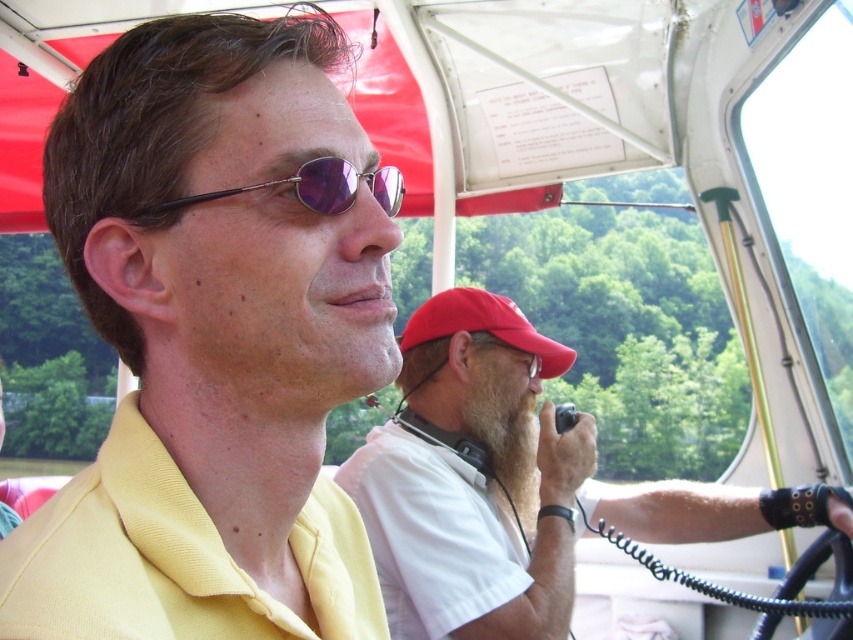
Measure the distance between white matte shirt at center and camera.

They are 4.77 feet apart.

Is white matte shirt at center behind metallic purple sunglasses at center?

Yes.

The height and width of the screenshot is (640, 853). Describe the element at coordinates (514, 483) in the screenshot. I see `white matte shirt at center` at that location.

You are a GUI agent. You are given a task and a screenshot of the screen. Output one action in this format:
    pyautogui.click(x=<x>, y=<y>)
    Task: Click on the white matte shirt at center
    
    Given the screenshot: What is the action you would take?
    pyautogui.click(x=514, y=483)

From the picture: Is yellow matte shirt at upper left to the right of metallic purple sunglasses at center from the viewer's perspective?

In fact, yellow matte shirt at upper left is to the left of metallic purple sunglasses at center.

What do you see at coordinates (215, 337) in the screenshot? Image resolution: width=853 pixels, height=640 pixels. I see `yellow matte shirt at upper left` at bounding box center [215, 337].

Is point (132, 364) farther from viewer compared to point (193, 202)?

Yes.

Image resolution: width=853 pixels, height=640 pixels. Identify the location of yellow matte shirt at upper left. (215, 337).

Does yellow matte shirt at upper left have a lesser width compared to white matte shirt at center?

Correct, yellow matte shirt at upper left's width is less than white matte shirt at center's.

Is yellow matte shirt at upper left positioned behind white matte shirt at center?

No, yellow matte shirt at upper left is in front of white matte shirt at center.

What do you see at coordinates (215, 337) in the screenshot? I see `yellow matte shirt at upper left` at bounding box center [215, 337].

Locate an element on the screen. The width and height of the screenshot is (853, 640). yellow matte shirt at upper left is located at coordinates (215, 337).